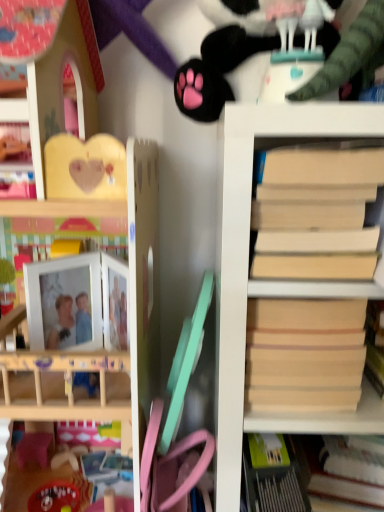
Question: From a real-world perspective, is wooden dollhouse at upper left, acting as the 1th shelf starting from the left, located beneath beige cardboard book at right?

Choices:
 (A) yes
 (B) no

Answer: (A)

Question: Is there a large distance between wooden dollhouse at upper left, acting as the 1th shelf starting from the left, and beige cardboard book at right?

Choices:
 (A) no
 (B) yes

Answer: (A)

Question: Can you confirm if wooden dollhouse at upper left, acting as the 1th shelf starting from the left, is positioned to the right of beige cardboard book at right?

Choices:
 (A) yes
 (B) no

Answer: (B)

Question: Is wooden dollhouse at upper left, the 2th shelf from the right, placed right next to beige cardboard book at right?

Choices:
 (A) no
 (B) yes

Answer: (A)

Question: From the image's perspective, would you say wooden dollhouse at upper left, acting as the 1th shelf starting from the left, is shown under beige cardboard book at right?

Choices:
 (A) yes
 (B) no

Answer: (A)

Question: In terms of width, does beige matte paper at right look wider or thinner when compared to light beige wood bookshelf at right, acting as the second shelf starting from the left?

Choices:
 (A) wide
 (B) thin

Answer: (B)

Question: From the image's perspective, relative to light beige wood bookshelf at right, acting as the second shelf starting from the left, is beige matte paper at right above or below?

Choices:
 (A) below
 (B) above

Answer: (B)

Question: Is beige matte paper at right taller or shorter than light beige wood bookshelf at right, acting as the second shelf starting from the left?

Choices:
 (A) short
 (B) tall

Answer: (A)

Question: Is beige matte paper at right to the left or to the right of light beige wood bookshelf at right, acting as the second shelf starting from the left, in the image?

Choices:
 (A) left
 (B) right

Answer: (A)

Question: Looking at the image, does beige matte paper at right seem bigger or smaller compared to black plush paw at upper center?

Choices:
 (A) big
 (B) small

Answer: (B)

Question: From the image's perspective, relative to black plush paw at upper center, is beige matte paper at right above or below?

Choices:
 (A) below
 (B) above

Answer: (A)

Question: Is beige matte paper at right taller or shorter than black plush paw at upper center?

Choices:
 (A) tall
 (B) short

Answer: (B)

Question: Considering the positions of beige matte paper at right and black plush paw at upper center in the image, is beige matte paper at right wider or thinner than black plush paw at upper center?

Choices:
 (A) thin
 (B) wide

Answer: (A)

Question: Considering the positions of point 139,311 and point 253,212, is point 139,311 closer or farther from the camera than point 253,212?

Choices:
 (A) closer
 (B) farther

Answer: (B)

Question: In the image, is wooden dollhouse at upper left, acting as the 1th shelf starting from the left, positioned in front of or behind beige cardboard book at right?

Choices:
 (A) front
 (B) behind

Answer: (B)